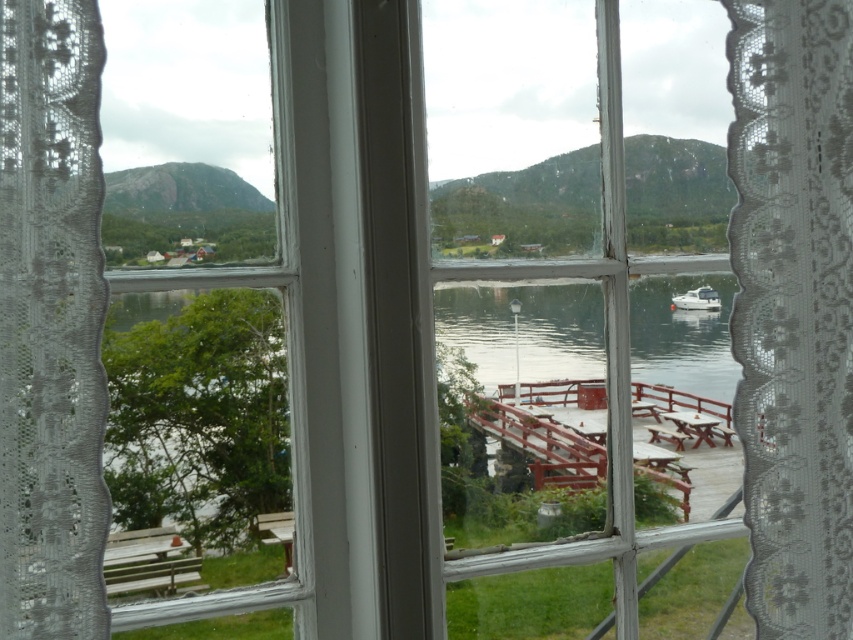
Question: Which of these objects is positioned closest to the white glossy boat at center-right?

Choices:
 (A) white lace curtain at center
 (B) white lace curtain at left

Answer: (A)

Question: Can you confirm if white lace curtain at center is smaller than white glossy boat at center-right?

Choices:
 (A) no
 (B) yes

Answer: (A)

Question: Which object appears closest to the camera in this image?

Choices:
 (A) white glossy boat at center-right
 (B) white lace curtain at left
 (C) white lace curtain at center

Answer: (B)

Question: Does white lace curtain at center come behind white lace curtain at left?

Choices:
 (A) yes
 (B) no

Answer: (A)

Question: In this image, where is white lace curtain at center located relative to white lace curtain at left?

Choices:
 (A) above
 (B) below

Answer: (A)

Question: Which point is closer to the camera?

Choices:
 (A) (749, 179)
 (B) (705, 300)

Answer: (A)